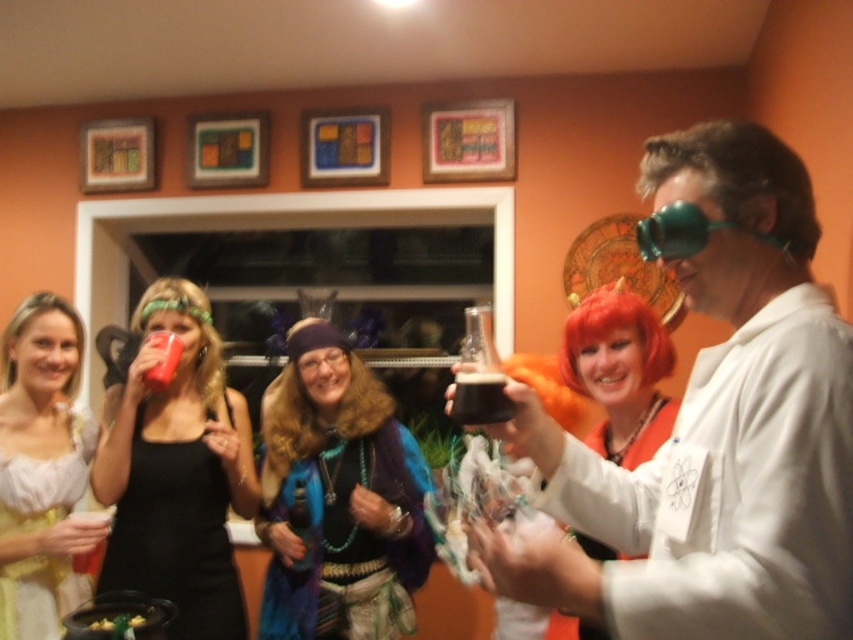
You are a photographer at the party and need to capture a photo that includes both the matte white dress at center and the green matte goggles at upper right. Since the camera has a limited focus range, which object should you focus on to ensure both are in focus?

You should focus on the matte white dress at center because it is larger than the green matte goggles at upper right, so focusing on the larger object increases the chance of both being in focus.

You are at a party and want to take a photo of the matte white dress at center and the green matte goggles at upper right. Which object should you focus on first if you want to capture both in the same frame without moving the camera?

The matte white dress at center is positioned on the left side of green matte goggles at upper right, so you should focus on the matte white dress at center first to ensure both are in the frame.